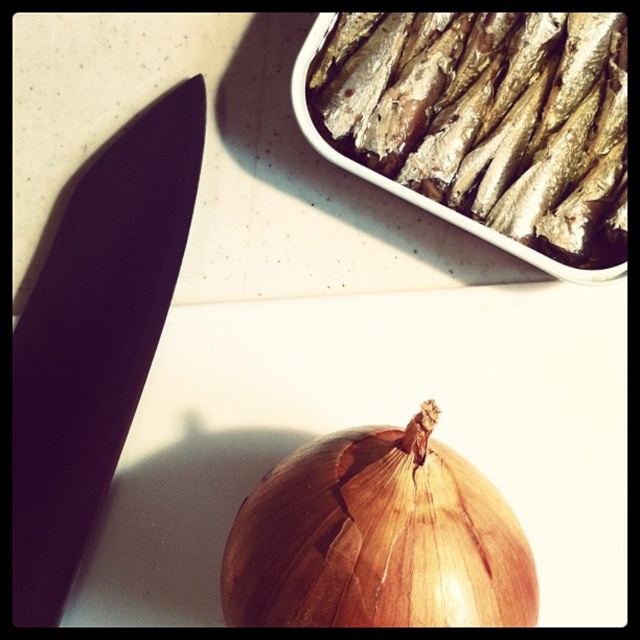
Question: Which point is farther to the camera?

Choices:
 (A) (227, 609)
 (B) (412, 186)

Answer: (B)

Question: Is shiny silver fish at upper right positioned at the back of brown matte onion at bottom center?

Choices:
 (A) no
 (B) yes

Answer: (B)

Question: Can you confirm if shiny silver fish at upper right is positioned below brown matte onion at bottom center?

Choices:
 (A) yes
 (B) no

Answer: (B)

Question: Can you confirm if shiny silver fish at upper right is positioned to the right of brown matte onion at bottom center?

Choices:
 (A) no
 (B) yes

Answer: (B)

Question: Among these objects, which one is nearest to the camera?

Choices:
 (A) shiny silver fish at upper right
 (B) brown matte onion at bottom center

Answer: (B)